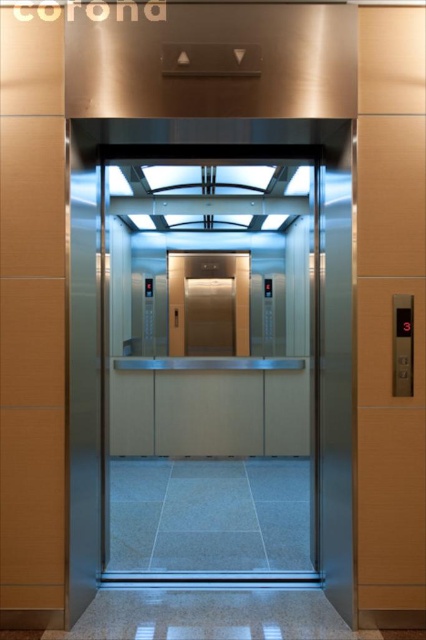
Question: Which point is closer to the camera taking this photo?

Choices:
 (A) (172, 452)
 (B) (181, 275)

Answer: (A)

Question: Can you confirm if transparent glass elevator at center is positioned to the left of polished brass elevator at center?

Choices:
 (A) no
 (B) yes

Answer: (A)

Question: Can you confirm if transparent glass elevator at center is thinner than polished brass elevator at center?

Choices:
 (A) yes
 (B) no

Answer: (B)

Question: Where is transparent glass elevator at center located in relation to polished brass elevator at center in the image?

Choices:
 (A) left
 (B) right

Answer: (B)